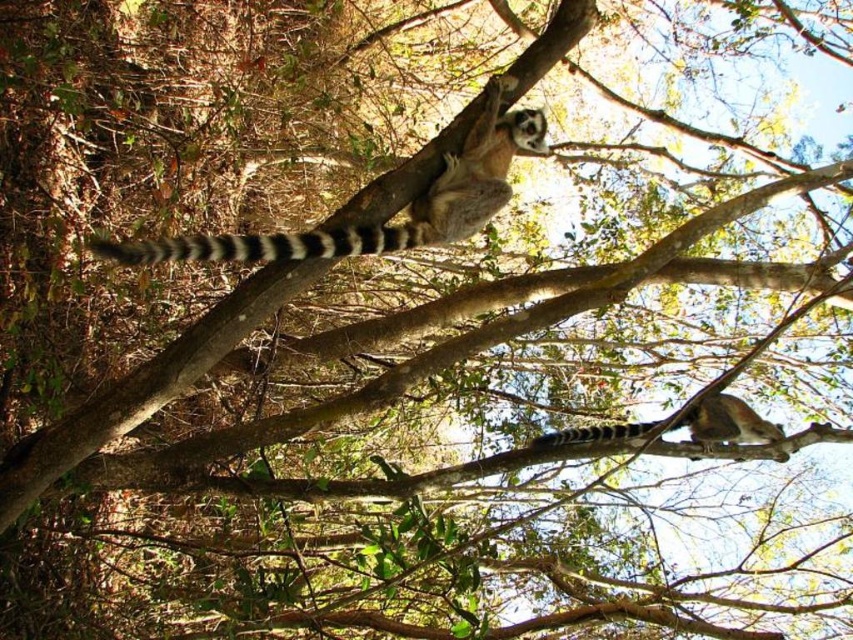
Between ring-tailed fur at upper center and white striped tail at upper center, which one is positioned lower?

white striped tail at upper center

Identify the location of ring-tailed fur at upper center. (380, 225).

Between point (461, 157) and point (718, 428), which one is positioned behind?

The point (718, 428) is behind.

Does ring-tailed fur at upper center have a lesser height compared to ring-tailed fur at center?

No.

Is point (479, 205) positioned after point (619, 428)?

No, (479, 205) is closer to viewer.

Locate an element on the screen. ring-tailed fur at upper center is located at coordinates (380, 225).

Does white striped tail at upper center appear under ring-tailed fur at center?

No, white striped tail at upper center is not below ring-tailed fur at center.

Which of these two, white striped tail at upper center or ring-tailed fur at center, stands taller?

ring-tailed fur at center is taller.

Does point (215, 260) come farther from viewer compared to point (635, 426)?

No, it is not.

You are a GUI agent. You are given a task and a screenshot of the screen. Output one action in this format:
    pyautogui.click(x=<x>, y=<y>)
    Task: Click on the white striped tail at upper center
    The height and width of the screenshot is (640, 853).
    Given the screenshot: What is the action you would take?
    pyautogui.click(x=270, y=244)